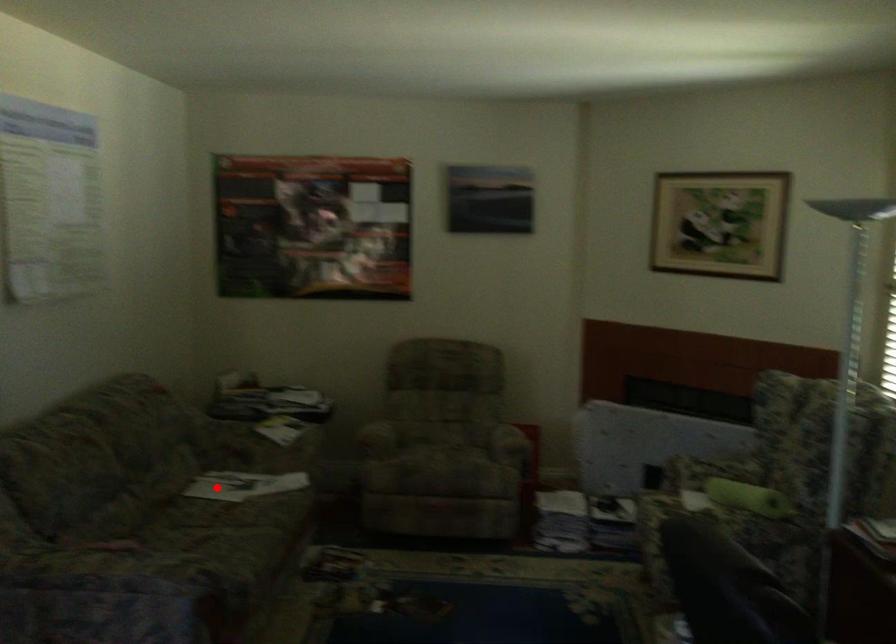
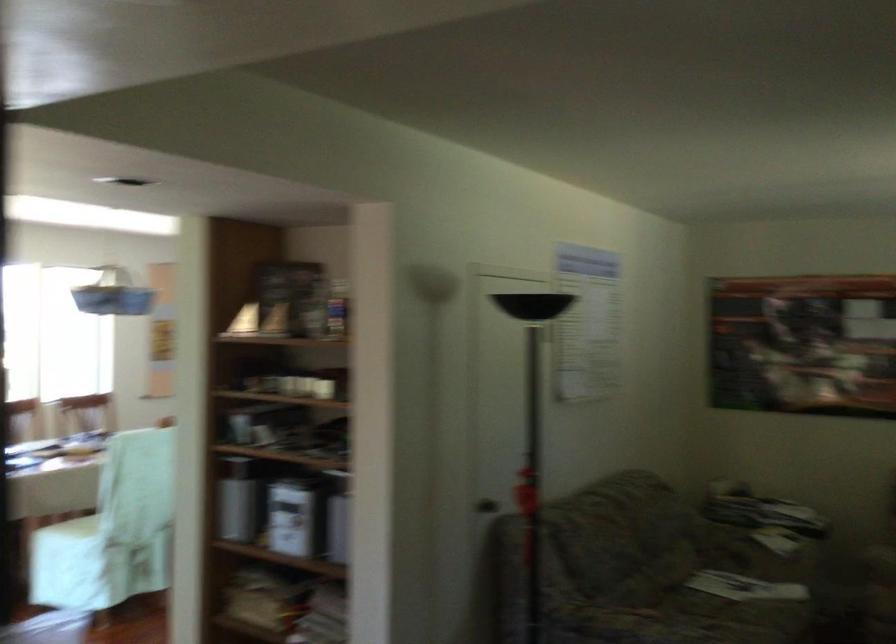
Question: I am providing you with two images of the same scene from different viewpoints. A red point is marked on the first image. At the location where the point appears in image 1, is it still visible in image 2?

Choices:
 (A) Yes
 (B) No

Answer: (B)